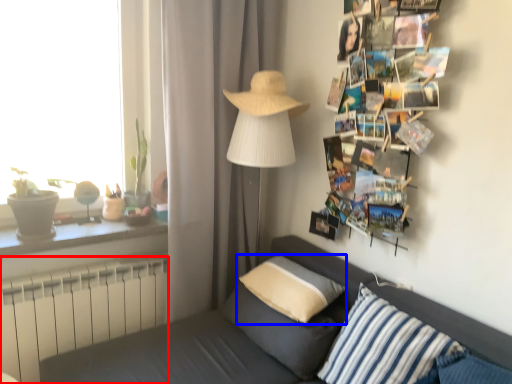
Question: Which of the following is the farthest to the observer, radiator (highlighted by a red box) or pillow (highlighted by a blue box)?

Choices:
 (A) radiator
 (B) pillow

Answer: (A)